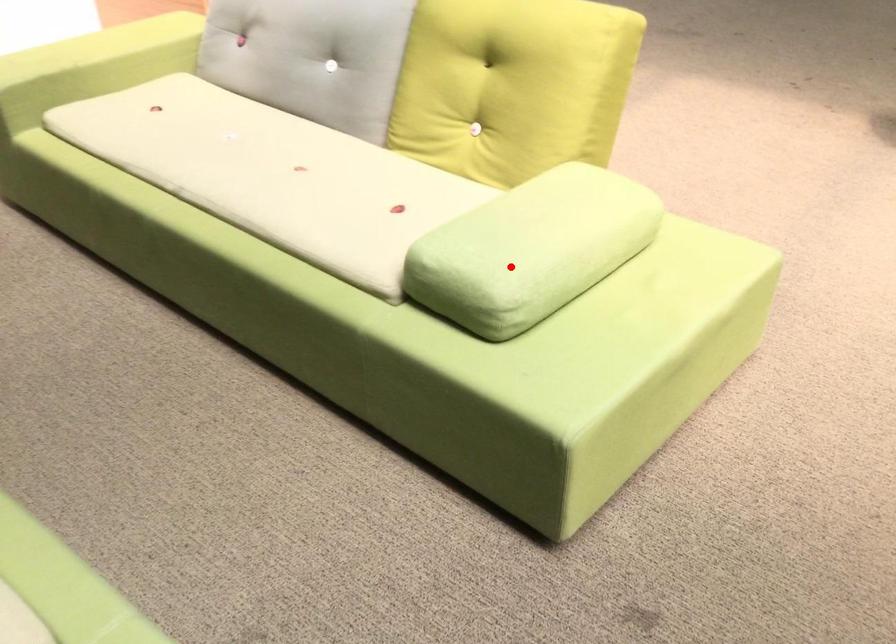
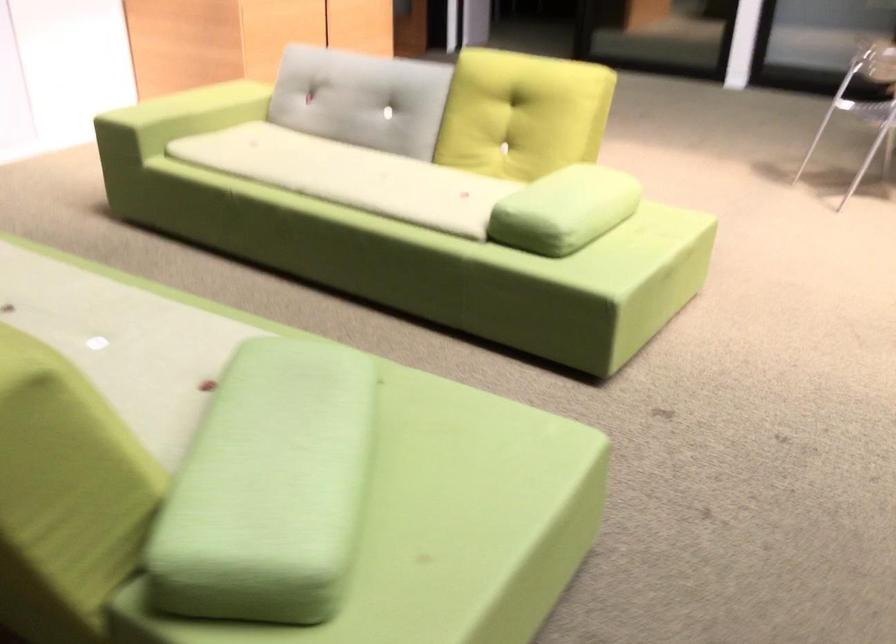
Question: I am providing you with two images of the same scene from different viewpoints. A red point is shown in image1. For the corresponding object point in image2, is it positioned nearer or farther from the camera?

Choices:
 (A) Nearer
 (B) Farther

Answer: (B)